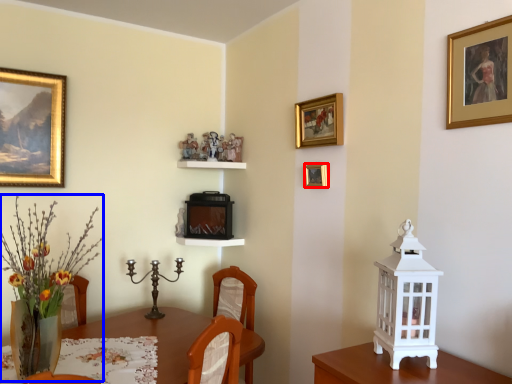
Question: Among these objects, which one is nearest to the camera, picture frame (highlighted by a red box) or floral arrangement (highlighted by a blue box)?

Choices:
 (A) picture frame
 (B) floral arrangement

Answer: (B)